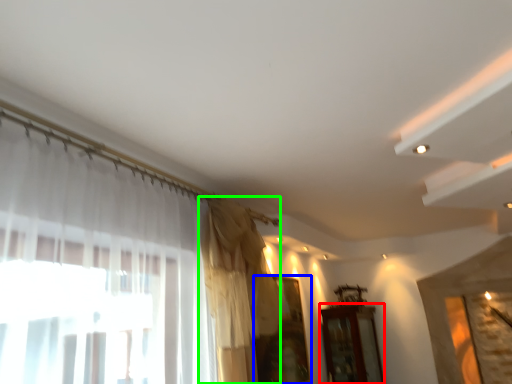
Question: Which is nearer to the furniture (highlighted by a red box)? window (highlighted by a blue box) or curtain (highlighted by a green box).

Choices:
 (A) window
 (B) curtain

Answer: (A)